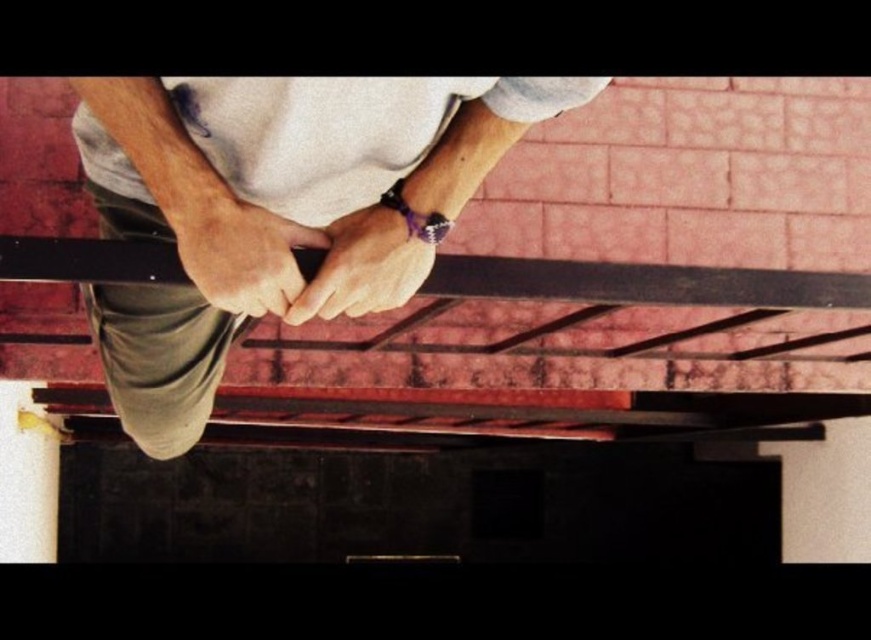
You are a photographer setting up equipment in the scene. You need to place a tripod between the matte black skateboard at center and the black matte beam at center. Based on their positions, which object should the tripod be closer to if you want it placed to the right of the skateboard?

The matte black skateboard at center is to the left of the black matte beam at center, so placing the tripod to the right of the skateboard would position it closer to the black matte beam at center.

You are a security guard observing a person at the entrance. You notice two hands at the center of your view. One is a smooth skin hand at center and the other is a satin brown leather hand at center. Which hand is closer to you?

The smooth skin hand at center is closer to you because it is located above the satin brown leather hand at center, indicating it is nearer in the visual hierarchy.

From the picture: You are a photographer adjusting your camera settings to focus on the person in the image. The camera has a focus point at coordinates point (238,250). What part of the person is the camera focusing on?

The camera is focusing on the smooth skin hand at center, as the point (238,250) marks this location.